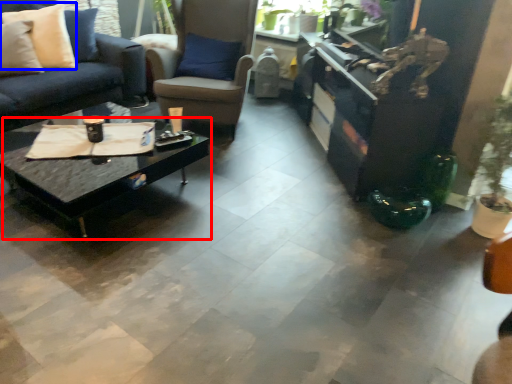
Question: Which point is closer to the camera, coffee table (highlighted by a red box) or pillow (highlighted by a blue box)?

Choices:
 (A) coffee table
 (B) pillow

Answer: (A)